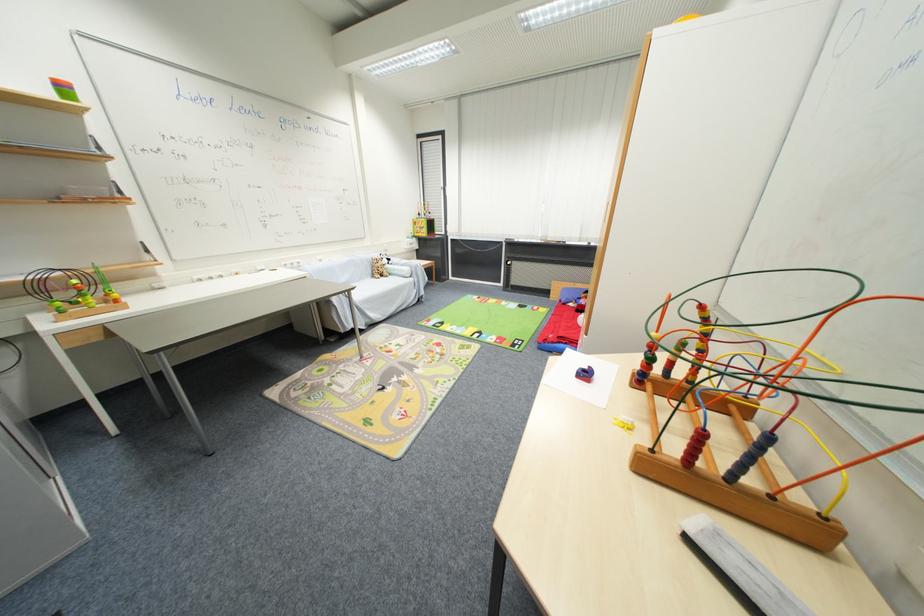
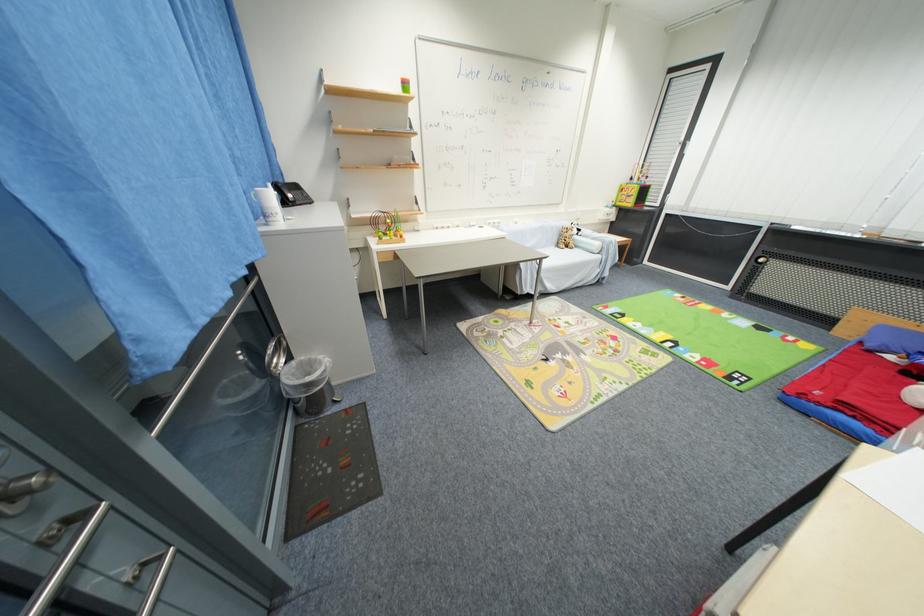
In the second image, find the point that corresponds to pixel 67 314 in the first image.

(385, 241)